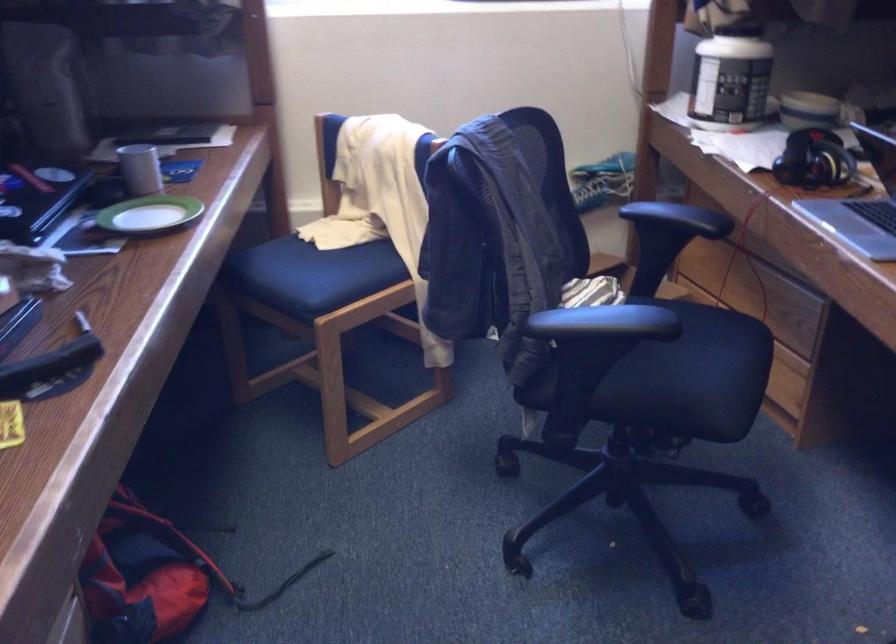
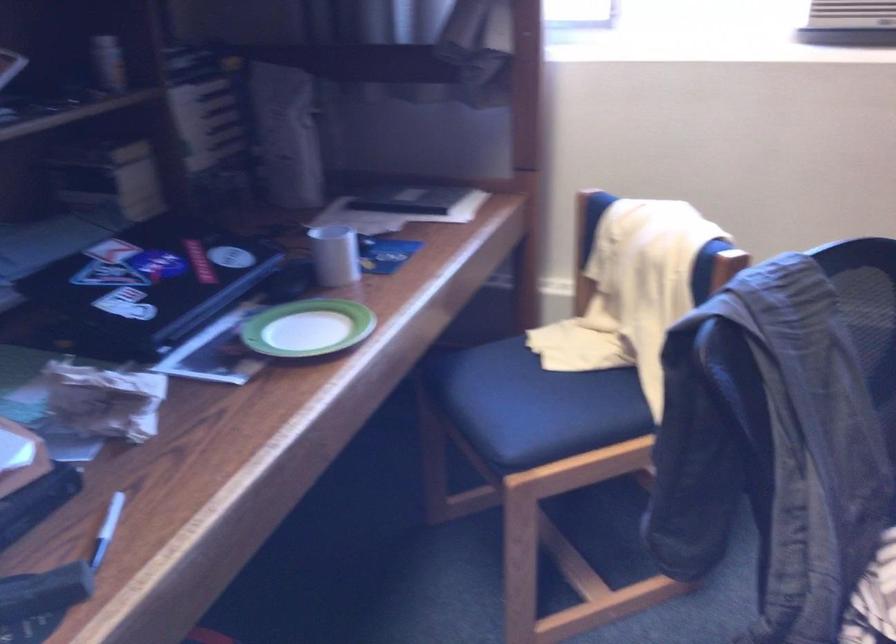
The point at (348, 261) is marked in the first image. Where is the corresponding point in the second image?

(576, 393)